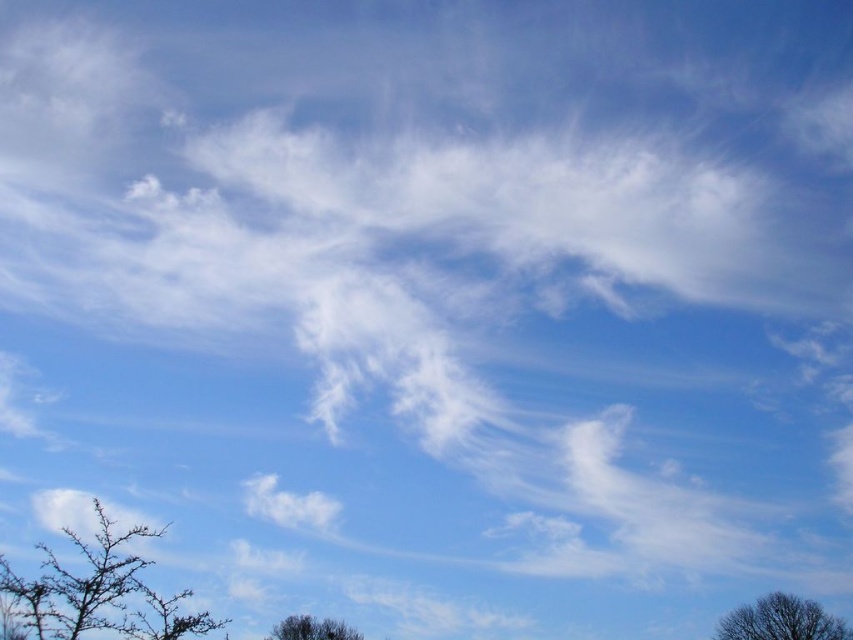
You are a bird looking for a nesting spot. You see the brown textured tree at lower right and the dark brown textured tree at lower center. Which tree is shorter and better for a small nest?

The brown textured tree at lower right is shorter than the dark brown textured tree at lower center, making it better for a small nest.

Based on the photo, you are an artist trying to paint the scene. You need to decide which object requires more detail in the painting. Based on their thickness, which one should you focus on more, the brown spiky branches at lower left or the dark brown textured tree at lower center?

The dark brown textured tree at lower center is thicker than the brown spiky branches at lower left, so you should focus more detail on the dark brown textured tree at lower center because thicker objects often require more intricate detailing to capture their texture and structure accurately.

You are a bird looking for a place to perch. You see the brown textured tree at lower right and the dark brown textured tree at lower center. Which tree is located below the other?

The brown textured tree at lower right is positioned under the dark brown textured tree at lower center.